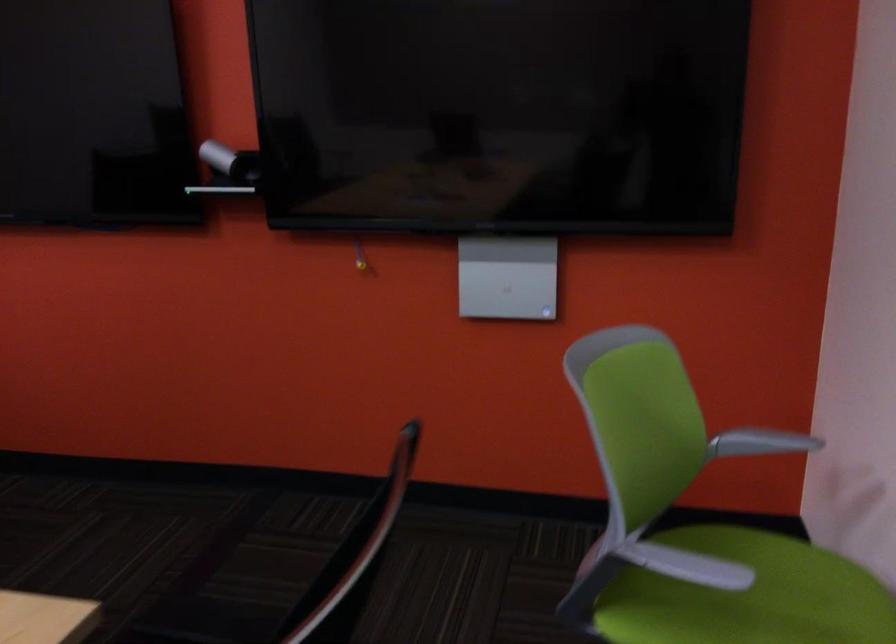
Find the location of a particular element. The height and width of the screenshot is (644, 896). grey chair armrest is located at coordinates (760, 442).